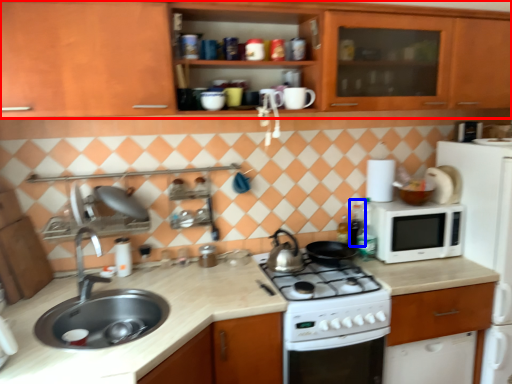
Question: Which object appears farthest to the camera in this image, cabinetry (highlighted by a red box) or bottle (highlighted by a blue box)?

Choices:
 (A) cabinetry
 (B) bottle

Answer: (B)